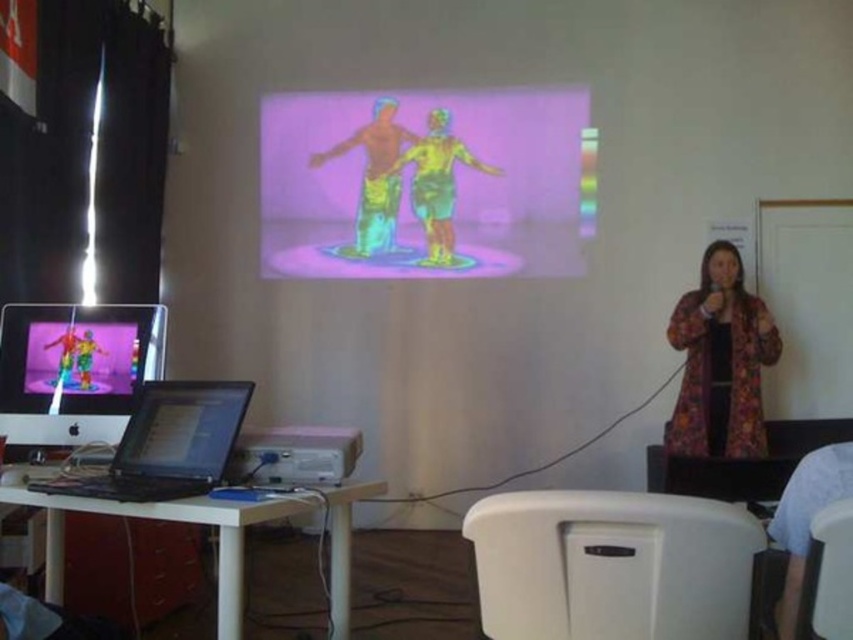
Question: Which object appears closest to the camera in this image?

Choices:
 (A) matte plastic toy at center
 (B) black plastic laptop at lower left
 (C) shiny black laptop at lower left

Answer: (B)

Question: Which point appears closest to the camera in this image?

Choices:
 (A) (163, 472)
 (B) (434, 141)

Answer: (A)

Question: Is black plastic laptop at lower left to the right of matte plastic toy at left from the viewer's perspective?

Choices:
 (A) no
 (B) yes

Answer: (B)

Question: Which object is positioned closest to the white wooden table at lower left?

Choices:
 (A) matte plastic toy at left
 (B) floral-patterned coat at right
 (C) black plastic laptop at lower left
 (D) white plastic chair at lower right

Answer: (C)

Question: Can you confirm if matte black monitor at left is bigger than translucent plastic figures at center?

Choices:
 (A) no
 (B) yes

Answer: (B)

Question: Considering the relative positions of white wooden table at lower left and white plastic chair at lower right in the image provided, where is white wooden table at lower left located with respect to white plastic chair at lower right?

Choices:
 (A) below
 (B) above

Answer: (A)